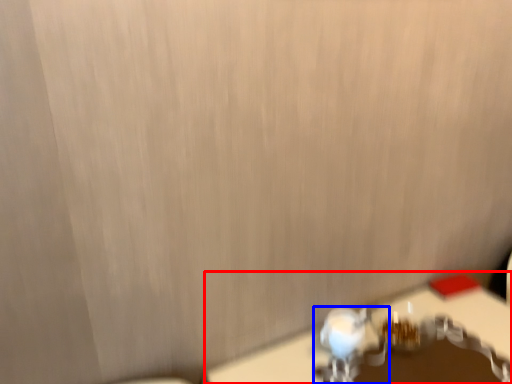
Question: Which object is further to the camera taking this photo, table (highlighted by a red box) or faucet (highlighted by a blue box)?

Choices:
 (A) table
 (B) faucet

Answer: (B)